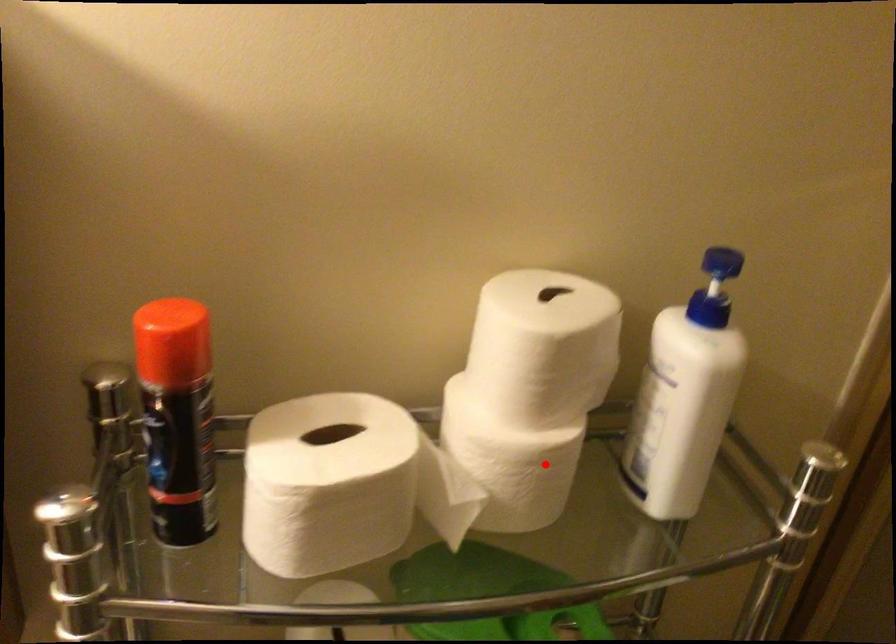
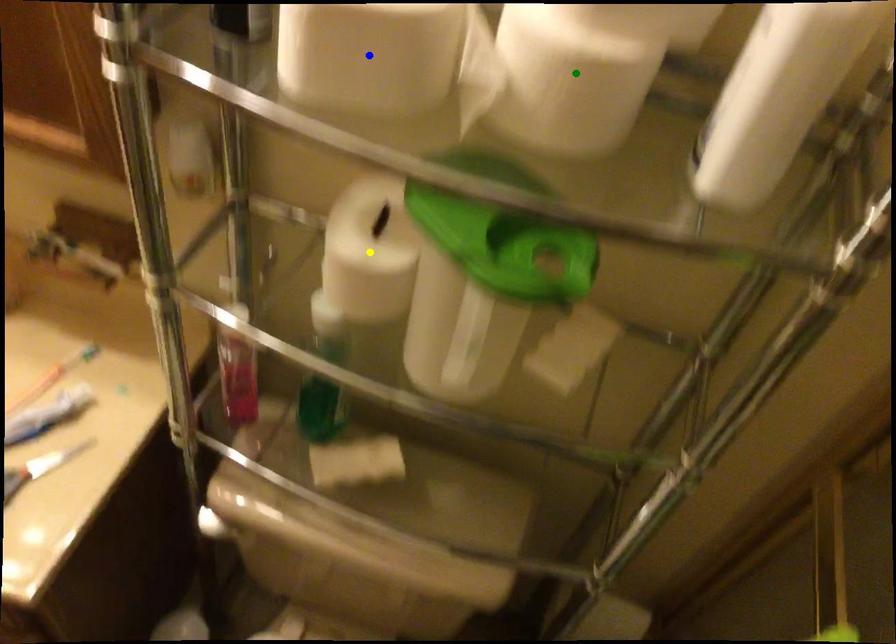
Question: I am providing you with two images of the same scene from different viewpoints. A red point is marked on the first image. You are given multiple points on the second image. Which point in image 2 is actually the same real-world point as the red point in image 1?

Choices:
 (A) green point
 (B) yellow point
 (C) blue point

Answer: (A)